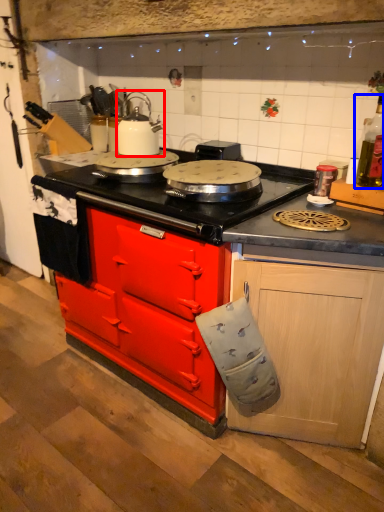
Question: Which object appears closest to the camera in this image, kitchen appliance (highlighted by a red box) or bottle (highlighted by a blue box)?

Choices:
 (A) kitchen appliance
 (B) bottle

Answer: (B)